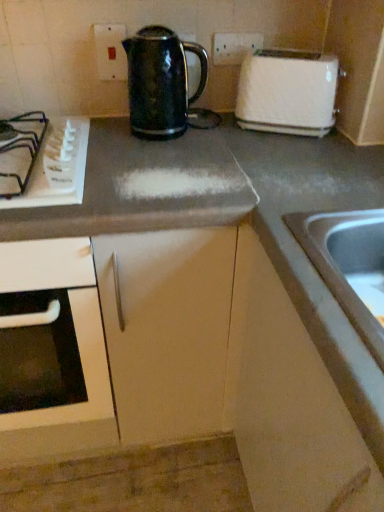
Question: In the image, is shiny black kettle at center on the left side or the right side of white plastic gas stove at left?

Choices:
 (A) right
 (B) left

Answer: (A)

Question: In terms of size, does shiny black kettle at center appear bigger or smaller than white plastic gas stove at left?

Choices:
 (A) small
 (B) big

Answer: (B)

Question: Which object is positioned closest to the white plastic gas stove at left?

Choices:
 (A) shiny black kettle at center
 (B) stainless steel sink at lower right
 (C) matte gray cabinet at center, placed as the 1th cabinetry when sorted from left to right
 (D) white plastic toaster at upper right
 (E) matte white electric outlet at upper center

Answer: (A)

Question: Which object is positioned closest to the white plastic gas stove at left?

Choices:
 (A) matte white electric outlet at upper center
 (B) white plastic toaster at upper right
 (C) matte gray cabinet at lower right, positioned as the 1th cabinetry in right-to-left order
 (D) shiny black kettle at center
 (E) matte gray cabinet at center, placed as the 1th cabinetry when sorted from left to right

Answer: (D)